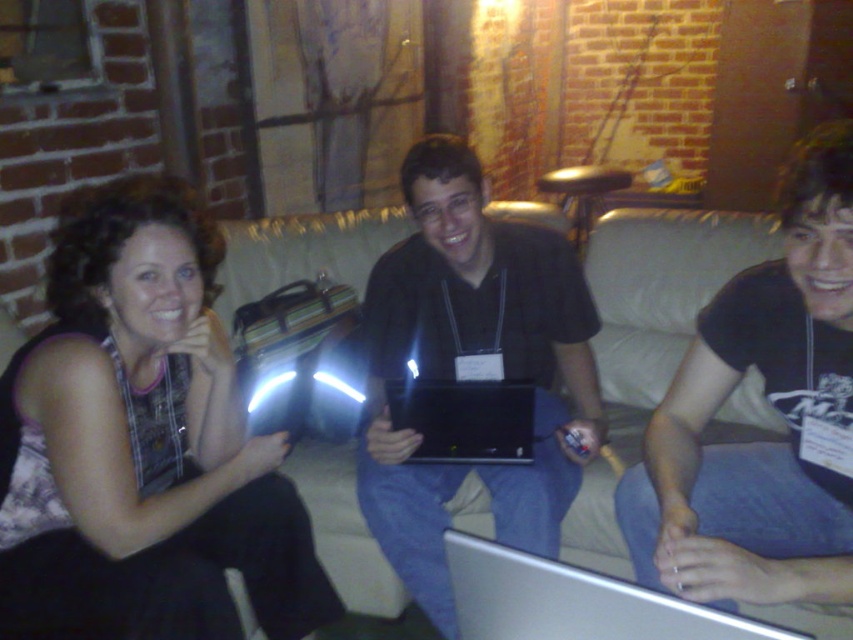
Is point (177, 586) in front of point (730, 321)?

Yes, point (177, 586) is closer to viewer.

What do you see at coordinates (142, 442) in the screenshot? This screenshot has height=640, width=853. I see `matte black purse at left` at bounding box center [142, 442].

Which is in front, point (213, 515) or point (798, 518)?

Point (798, 518) is in front.

What are the coordinates of `matte black purse at left` in the screenshot? It's located at (142, 442).

Locate an element on the screen. beige fabric couch at center is located at coordinates (659, 298).

Does beige fabric couch at center appear on the right side of black glossy laptop at center?

Yes, beige fabric couch at center is to the right of black glossy laptop at center.

The height and width of the screenshot is (640, 853). Describe the element at coordinates (659, 298) in the screenshot. I see `beige fabric couch at center` at that location.

Find the location of a particular element. beige fabric couch at center is located at coordinates (659, 298).

Is black cotton shirt at center right smaller than silver metallic laptop at lower center?

Incorrect, black cotton shirt at center right is not smaller in size than silver metallic laptop at lower center.

Is black cotton shirt at center right further to the viewer compared to silver metallic laptop at lower center?

Yes, it is behind silver metallic laptop at lower center.

Which is in front, point (808, 237) or point (625, 596)?

Point (625, 596)

Where is `black cotton shirt at center right`? The height and width of the screenshot is (640, 853). black cotton shirt at center right is located at coordinates (773, 406).